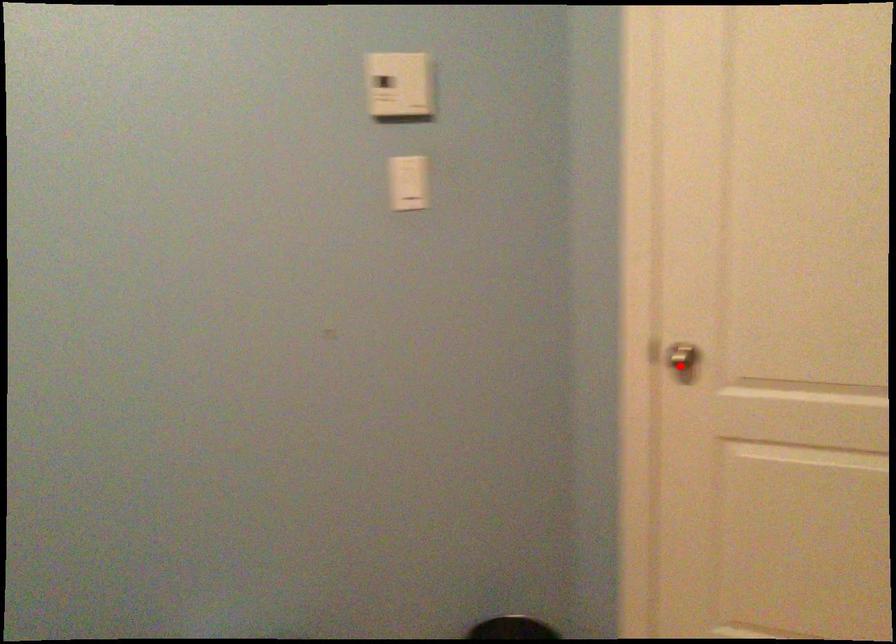
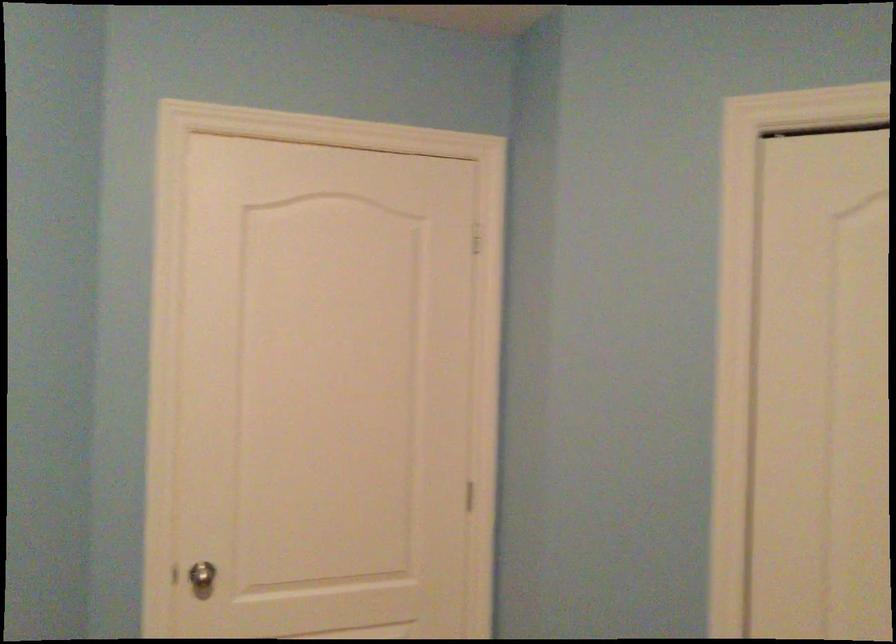
Question: I am providing you with two images of the same scene from different viewpoints. A red point is shown in image1. For the corresponding object point in image2, is it positioned nearer or farther from the camera?

Choices:
 (A) Nearer
 (B) Farther

Answer: (B)